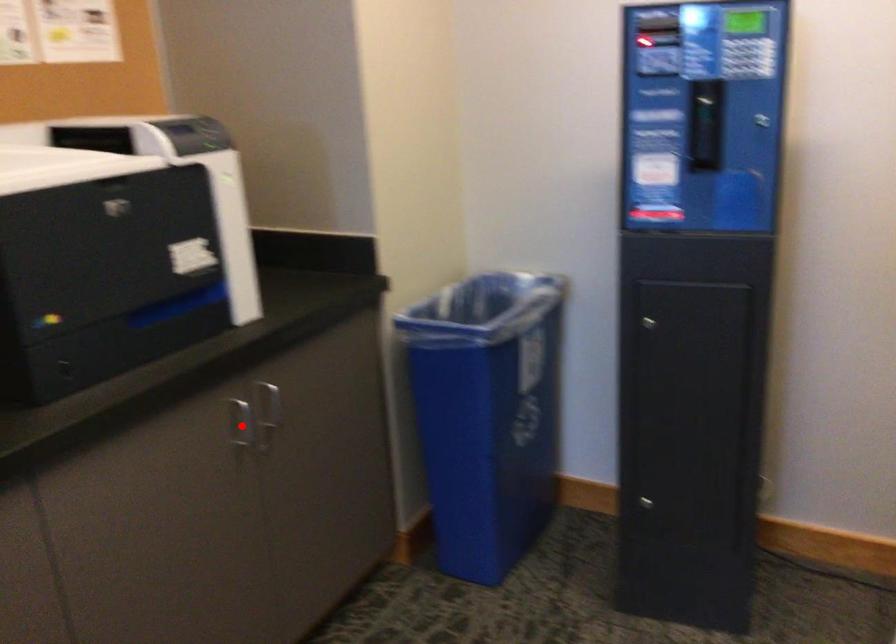
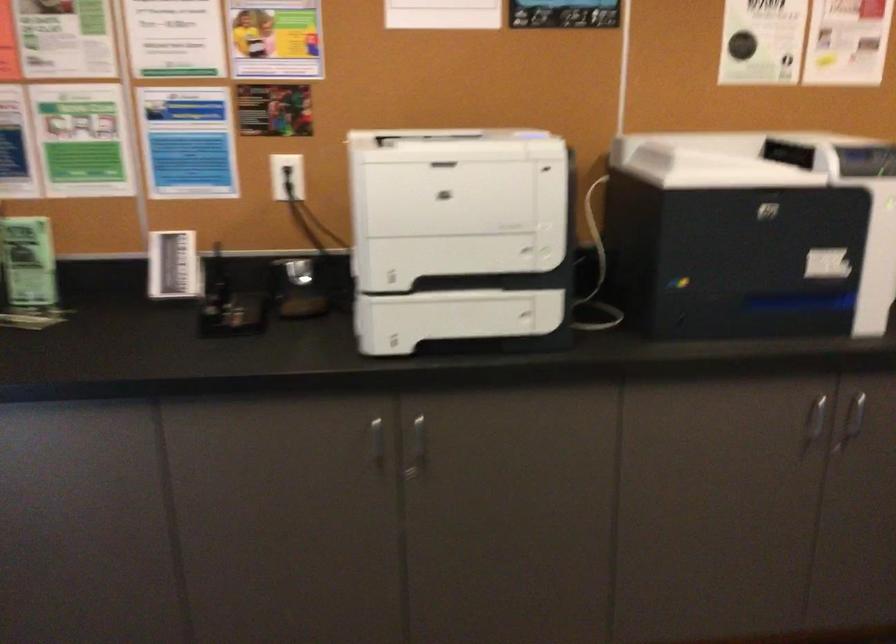
Where in the second image is the point corresponding to the highlighted location from the first image?

(815, 422)